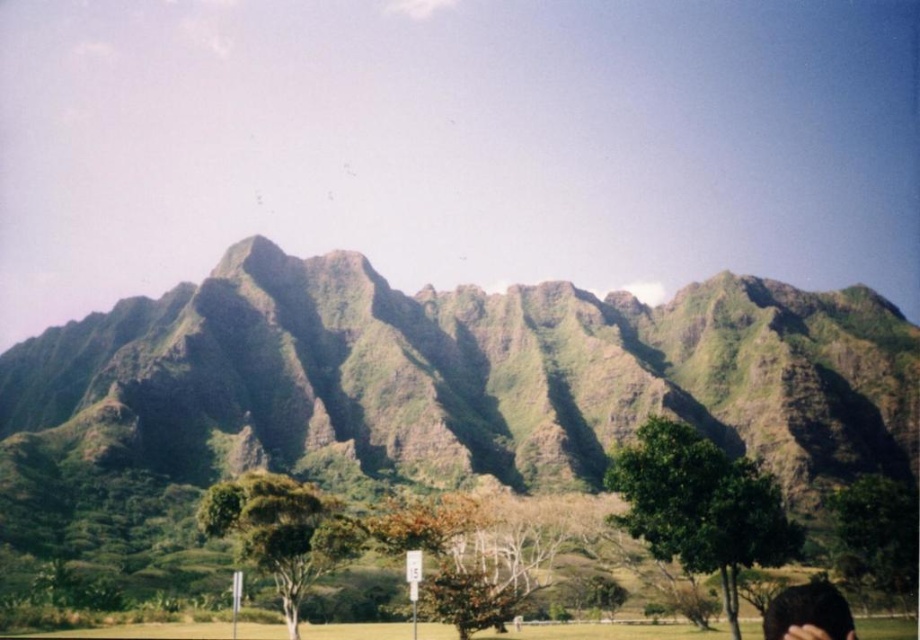
Question: Is green rough mountain at center further to camera compared to dark brown hair at lower right?

Choices:
 (A) yes
 (B) no

Answer: (A)

Question: Which point is farther from the camera taking this photo?

Choices:
 (A) (844, 620)
 (B) (8, 484)

Answer: (B)

Question: Is green rough mountain at center below dark brown hair at lower right?

Choices:
 (A) no
 (B) yes

Answer: (A)

Question: Which object is farther from the camera taking this photo?

Choices:
 (A) dark brown hair at lower right
 (B) green rough mountain at center

Answer: (B)

Question: Which point is farther from the camera taking this photo?

Choices:
 (A) pos(546,483)
 (B) pos(808,582)

Answer: (A)

Question: Is green rough mountain at center closer to camera compared to dark brown hair at lower right?

Choices:
 (A) yes
 (B) no

Answer: (B)